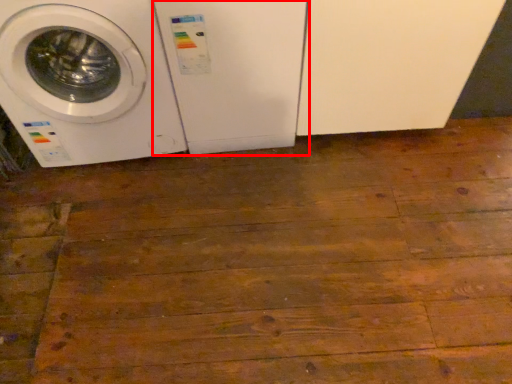
Question: Where is washing machine (annotated by the red box) located in relation to washing machine in the image?

Choices:
 (A) right
 (B) left

Answer: (A)